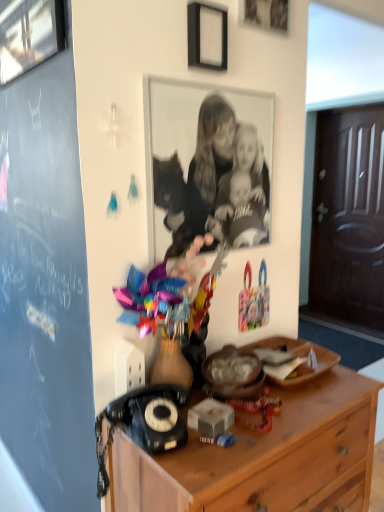
Measure the distance between point (242, 245) and camera.

Point (242, 245) is 4.82 feet away from camera.

This screenshot has height=512, width=384. What do you see at coordinates (207, 36) in the screenshot?
I see `black matte picture frame at upper center, which is the second picture frame from right to left` at bounding box center [207, 36].

The image size is (384, 512). Describe the element at coordinates (29, 35) in the screenshot. I see `brushed metal picture frame at upper left, positioned as the 3th picture frame in right-to-left order` at that location.

Identify the location of metallic silver toy at center. (170, 295).

Where is `wooden picture frame at upper center, which appears as the third picture frame when viewed from the left`? wooden picture frame at upper center, which appears as the third picture frame when viewed from the left is located at coordinates (265, 14).

Measure the distance between point [273,340] and camera.

Point [273,340] is 1.66 meters away from camera.

Find the location of `wooden chest of drawers at lower right`. wooden chest of drawers at lower right is located at coordinates (263, 457).

At what (x,y) coordinates should I click in order to perform the action: click on black and white photograph of family at center. Please return your answer as a coordinate pair (x, y). The width and height of the screenshot is (384, 512). Looking at the image, I should click on (211, 175).

Between brushed metal picture frame at upper left, positioned as the 3th picture frame in right-to-left order, and black matte picture frame at upper center, which is the second picture frame from right to left, which one has larger size?

With larger size is brushed metal picture frame at upper left, positioned as the 3th picture frame in right-to-left order.

From the image's perspective, is brushed metal picture frame at upper left, which ranks as the 1th picture frame in left-to-right order, located above or below black matte picture frame at upper center, which is the second picture frame from right to left?

From the image's perspective, brushed metal picture frame at upper left, which ranks as the 1th picture frame in left-to-right order, appears above black matte picture frame at upper center, which is the second picture frame from right to left.

Is brushed metal picture frame at upper left, positioned as the 3th picture frame in right-to-left order, at the right side of black matte picture frame at upper center, which is the second picture frame from right to left?

In fact, brushed metal picture frame at upper left, positioned as the 3th picture frame in right-to-left order, is to the left of black matte picture frame at upper center, which is the second picture frame from right to left.

Could you measure the distance between brushed metal picture frame at upper left, which ranks as the 1th picture frame in left-to-right order, and black matte picture frame at upper center, which is the second picture frame from right to left?

brushed metal picture frame at upper left, which ranks as the 1th picture frame in left-to-right order, and black matte picture frame at upper center, which is the second picture frame from right to left, are 18.17 inches apart from each other.

From the image's perspective, which one is positioned lower, wooden plate at center or black matte picture frame at upper center, the 2th picture frame in the left-to-right sequence?

wooden plate at center, from the image's perspective.

In the scene shown: Which of these two, wooden plate at center or black matte picture frame at upper center, the 2th picture frame in the left-to-right sequence, stands shorter?

wooden plate at center.

From a real-world perspective, is wooden plate at center positioned above or below black matte picture frame at upper center, the 2th picture frame in the left-to-right sequence?

wooden plate at center is situated lower than black matte picture frame at upper center, the 2th picture frame in the left-to-right sequence, in the real world.

Can you confirm if wooden plate at center is smaller than black matte picture frame at upper center, which is the second picture frame from right to left?

No, wooden plate at center is not smaller than black matte picture frame at upper center, which is the second picture frame from right to left.

Is wooden picture frame at upper center, acting as the 1th picture frame starting from the right, oriented towards black plastic rotary phone at lower left?

No, wooden picture frame at upper center, acting as the 1th picture frame starting from the right, is not aimed at black plastic rotary phone at lower left.

Is wooden picture frame at upper center, which appears as the third picture frame when viewed from the left, not within black plastic rotary phone at lower left?

Yes.

Considering the relative sizes of wooden picture frame at upper center, which appears as the third picture frame when viewed from the left, and black plastic rotary phone at lower left in the image provided, is wooden picture frame at upper center, which appears as the third picture frame when viewed from the left, taller than black plastic rotary phone at lower left?

Indeed, wooden picture frame at upper center, which appears as the third picture frame when viewed from the left, has a greater height compared to black plastic rotary phone at lower left.

Measure the distance from wooden picture frame at upper center, acting as the 1th picture frame starting from the right, to black plastic rotary phone at lower left.

4.00 feet.

From the picture: Is black matte picture frame at upper center, the 2th picture frame in the left-to-right sequence, located outside black and white photograph of family at center?

That's correct, black matte picture frame at upper center, the 2th picture frame in the left-to-right sequence, is outside of black and white photograph of family at center.

From the image's perspective, between black matte picture frame at upper center, which is the second picture frame from right to left, and black and white photograph of family at center, who is located below?

black and white photograph of family at center.

Are black matte picture frame at upper center, which is the second picture frame from right to left, and black and white photograph of family at center located far from each other?

No, there isn't a large distance between black matte picture frame at upper center, which is the second picture frame from right to left, and black and white photograph of family at center.

Is metallic silver toy at center placed right next to brushed metal picture frame at upper left, positioned as the 3th picture frame in right-to-left order?

No, metallic silver toy at center is not making contact with brushed metal picture frame at upper left, positioned as the 3th picture frame in right-to-left order.

Choose the correct answer: Is metallic silver toy at center inside brushed metal picture frame at upper left, positioned as the 3th picture frame in right-to-left order, or outside it?

metallic silver toy at center is not inside brushed metal picture frame at upper left, positioned as the 3th picture frame in right-to-left order, it's outside.

From the image's perspective, is metallic silver toy at center above or below brushed metal picture frame at upper left, which ranks as the 1th picture frame in left-to-right order?

Based on their image positions, metallic silver toy at center is located beneath brushed metal picture frame at upper left, which ranks as the 1th picture frame in left-to-right order.

Could you tell me if metallic silver toy at center is turned towards brushed metal picture frame at upper left, positioned as the 3th picture frame in right-to-left order?

No, metallic silver toy at center is not facing towards brushed metal picture frame at upper left, positioned as the 3th picture frame in right-to-left order.

Is metallic silver toy at center shorter than wooden plate at center?

In fact, metallic silver toy at center may be taller than wooden plate at center.

What's the angular difference between metallic silver toy at center and wooden plate at center's facing directions?

There is a 0.84-degree angle between the facing directions of metallic silver toy at center and wooden plate at center.

Is metallic silver toy at center positioned behind wooden plate at center?

No, the depth of metallic silver toy at center is less than that of wooden plate at center.

Is metallic silver toy at center at the right side of wooden plate at center?

Incorrect, metallic silver toy at center is not on the right side of wooden plate at center.

Is wooden chest of drawers at lower right positioned with its back to brushed metal picture frame at upper left, positioned as the 3th picture frame in right-to-left order?

No.

Identify the location of cabinetry located on the right of brushed metal picture frame at upper left, positioned as the 3th picture frame in right-to-left order. The image size is (384, 512). (263, 457).

Is wooden chest of drawers at lower right closer to camera compared to brushed metal picture frame at upper left, which ranks as the 1th picture frame in left-to-right order?

That is True.

I want to click on the 1st picture frame directly above the black matte picture frame at upper center, the 2th picture frame in the left-to-right sequence (from a real-world perspective), so click(29, 35).

Identify the location of plate located below the black matte picture frame at upper center, which is the second picture frame from right to left (from the image's perspective). click(297, 359).

From the image, which object appears to be nearer to wooden plate at center, wooden picture frame at upper center, acting as the 1th picture frame starting from the right, or brushed metal picture frame at upper left, which ranks as the 1th picture frame in left-to-right order?

Based on the image, wooden picture frame at upper center, acting as the 1th picture frame starting from the right, appears to be nearer to wooden plate at center.

Considering their positions, is wooden picture frame at upper center, acting as the 1th picture frame starting from the right, positioned closer to black plastic rotary phone at lower left than brushed metal picture frame at upper left, which ranks as the 1th picture frame in left-to-right order?

brushed metal picture frame at upper left, which ranks as the 1th picture frame in left-to-right order, is positioned closer to the anchor black plastic rotary phone at lower left.

Based on their spatial positions, is wooden chest of drawers at lower right or black and white photograph of family at center further from wooden plate at center?

Based on the image, black and white photograph of family at center appears to be further to wooden plate at center.

Which object lies nearer to the anchor point brushed metal picture frame at upper left, positioned as the 3th picture frame in right-to-left order, wooden picture frame at upper center, acting as the 1th picture frame starting from the right, or metallic silver toy at center?

The object closer to brushed metal picture frame at upper left, positioned as the 3th picture frame in right-to-left order, is wooden picture frame at upper center, acting as the 1th picture frame starting from the right.

Which object lies nearer to the anchor point wooden chest of drawers at lower right, wooden picture frame at upper center, which appears as the third picture frame when viewed from the left, or black plastic rotary phone at lower left?

black plastic rotary phone at lower left is closer to wooden chest of drawers at lower right.

Looking at the image, which one is located further to metallic silver toy at center, black matte picture frame at upper center, which is the second picture frame from right to left, or brushed metal picture frame at upper left, positioned as the 3th picture frame in right-to-left order?

The object further to metallic silver toy at center is brushed metal picture frame at upper left, positioned as the 3th picture frame in right-to-left order.

Looking at the image, which one is located closer to wooden plate at center, brushed metal picture frame at upper left, positioned as the 3th picture frame in right-to-left order, or black matte picture frame at upper center, which is the second picture frame from right to left?

black matte picture frame at upper center, which is the second picture frame from right to left, is positioned closer to the anchor wooden plate at center.

Estimate the real-world distances between objects in this image. Which object is closer to black and white photograph of family at center, brushed metal picture frame at upper left, positioned as the 3th picture frame in right-to-left order, or metallic silver toy at center?

The object closer to black and white photograph of family at center is metallic silver toy at center.

The image size is (384, 512). Find the location of `person between wooden picture frame at upper center, acting as the 1th picture frame starting from the right, and black plastic rotary phone at lower left, in the vertical direction`. person between wooden picture frame at upper center, acting as the 1th picture frame starting from the right, and black plastic rotary phone at lower left, in the vertical direction is located at coordinates (211, 175).

Identify the location of picture frame between brushed metal picture frame at upper left, positioned as the 3th picture frame in right-to-left order, and wooden chest of drawers at lower right, in the vertical direction. Image resolution: width=384 pixels, height=512 pixels. (207, 36).

Identify the location of toy between brushed metal picture frame at upper left, positioned as the 3th picture frame in right-to-left order, and wooden plate at center, in the vertical direction. This screenshot has height=512, width=384. (170, 295).

What are the coordinates of `toy between black matte picture frame at upper center, the 2th picture frame in the left-to-right sequence, and black plastic rotary phone at lower left, in the vertical direction` in the screenshot? It's located at (170, 295).